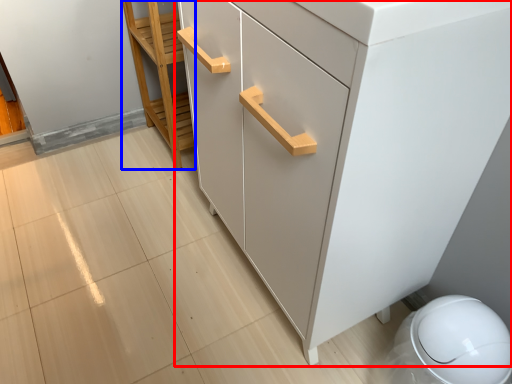
Question: Among these objects, which one is nearest to the camera, chest of drawers (highlighted by a red box) or furniture (highlighted by a blue box)?

Choices:
 (A) chest of drawers
 (B) furniture

Answer: (A)